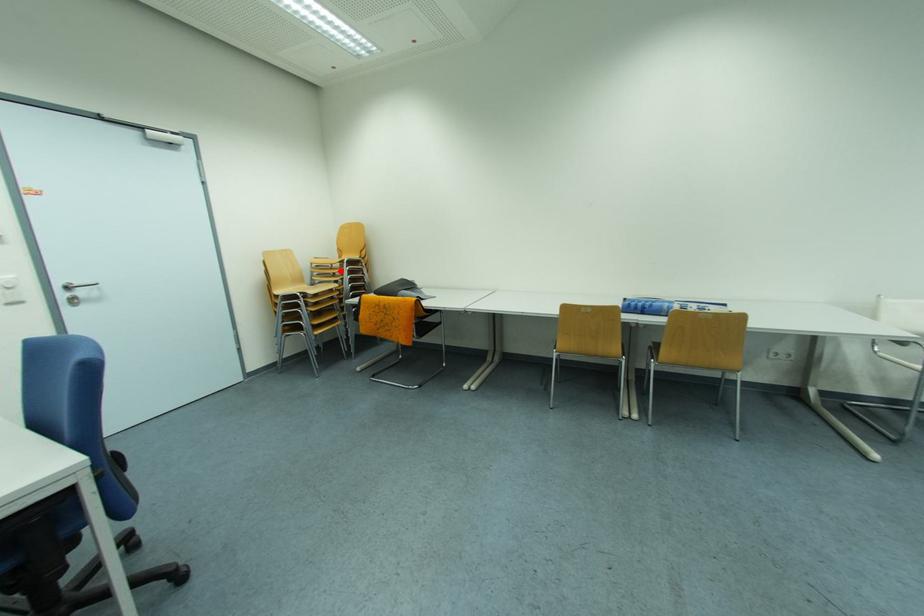
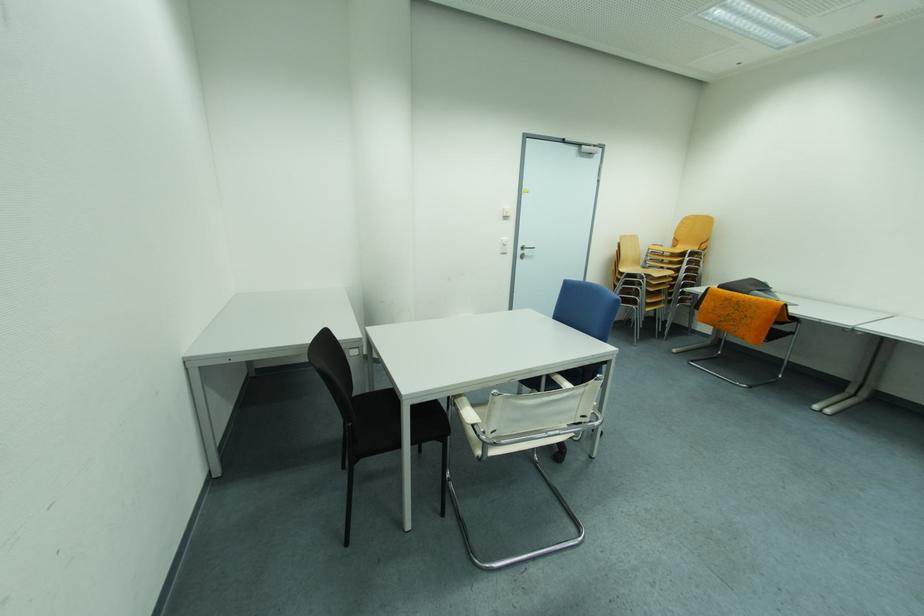
Where in the second image is the point corresponding to the highlighted location from the first image?

(671, 257)